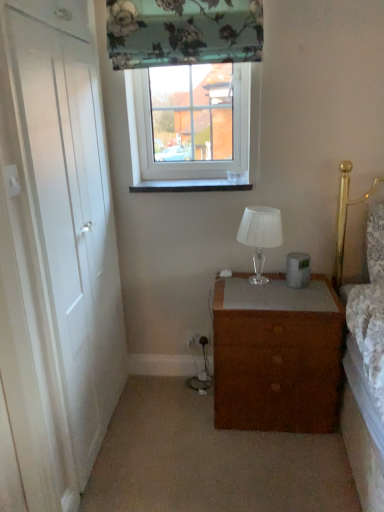
The height and width of the screenshot is (512, 384). I want to click on spots to the right of white wooden door at left, so click(x=174, y=432).